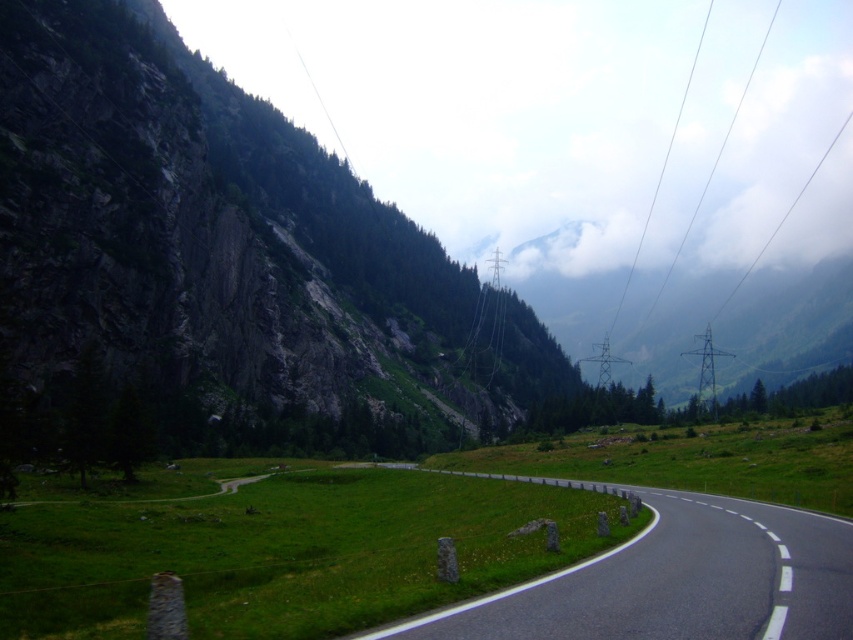
You are driving a car that needs to navigate the mountain road shown in the image. Considering the rugged stone mountain at left, which side of the road should you stay closer to for safety?

You should stay closer to the left side of the road because the rugged stone mountain at left is located at point [225,243], indicating it is near the road, so driving closer to the mountain side might be safer to avoid the steep drop on the opposite side.

You are driving a car and want to park on the black asphalt road at center. Can you safely park your car on the road without being blocked by the rugged stone mountain at left?

The rugged stone mountain at left is located above the black asphalt road at center, so it does not block the road. You can safely park your car on the black asphalt road at center.

You are driving a truck that requires a clearance of 15 feet to pass under any obstacles. Based on the scene, can you safely navigate the black asphalt road at center while avoiding the rugged stone mountain at left?

The rugged stone mountain at left is much taller than the black asphalt road at center. Since the mountain is taller, it may have overhanging parts or obstacles that could be lower than its peak. However, the description does not specify the exact height of any overhangs or obstacles above the road. Without specific clearance information, it is uncertain if the 15 feet clearance requirement will be met. Proceed with caution and check for any visible obstacles before proceeding.